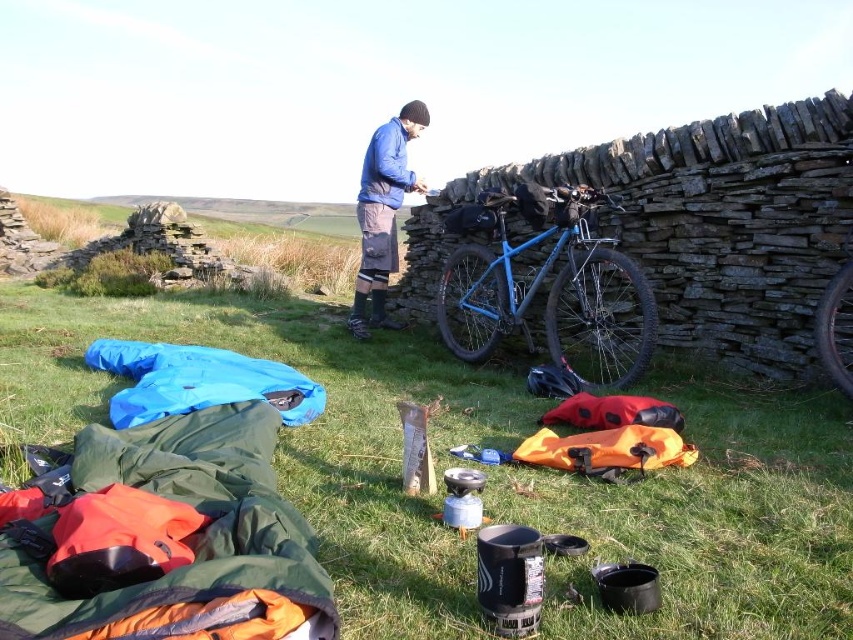
Does blue matte bicycle at center have a greater width compared to blue fleece jacket at center?

Yes.

Is point (505, 323) more distant than point (397, 262)?

That is False.

Is point (515, 326) farther from camera compared to point (383, 257)?

No, (515, 326) is in front of (383, 257).

I want to click on blue matte bicycle at center, so click(549, 289).

From the picture: Can you confirm if green grass at center is shorter than blue fleece jacket at center?

Correct, green grass at center is not as tall as blue fleece jacket at center.

Is green grass at center wider than blue fleece jacket at center?

Yes.

This screenshot has width=853, height=640. What are the coordinates of `green grass at center` in the screenshot? It's located at (488, 472).

At what (x,y) coordinates should I click in order to perform the action: click on green grass at center. Please return your answer as a coordinate pair (x, y). This screenshot has height=640, width=853. Looking at the image, I should click on (488, 472).

Which is in front, point (743, 540) or point (550, 188)?

Point (743, 540)

Is point (473, 401) farther from camera compared to point (647, 342)?

No, (473, 401) is closer to viewer.

Consider the image. Who is more distant from viewer, (x=738, y=410) or (x=479, y=202)?

The point (x=479, y=202) is more distant.

Identify the location of green grass at center. (488, 472).